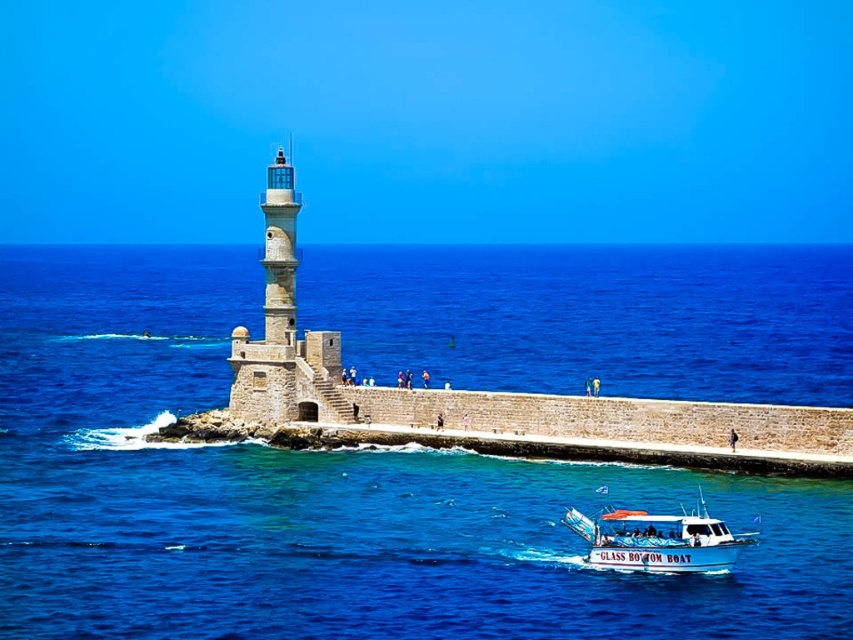
Between stone lighthouse at center and white glossy glass-bottom boat at lower center, which one has more height?

stone lighthouse at center is taller.

This screenshot has width=853, height=640. What are the coordinates of `stone lighthouse at center` in the screenshot? It's located at (283, 328).

Is the position of blue stone water at center more distant than that of smooth stone lighthouse at center?

No, blue stone water at center is in front of smooth stone lighthouse at center.

Does blue stone water at center lie in front of smooth stone lighthouse at center?

Yes, it is in front of smooth stone lighthouse at center.

The width and height of the screenshot is (853, 640). Describe the element at coordinates (322, 496) in the screenshot. I see `blue stone water at center` at that location.

At what (x,y) coordinates should I click in order to perform the action: click on blue stone water at center. Please return your answer as a coordinate pair (x, y). Image resolution: width=853 pixels, height=640 pixels. Looking at the image, I should click on (322, 496).

Does white glossy glass-bottom boat at lower center appear under smooth stone lighthouse at center?

Yes.

Can you confirm if white glossy glass-bottom boat at lower center is shorter than smooth stone lighthouse at center?

Yes.

Between point (666, 566) and point (282, 241), which one is positioned behind?

Positioned behind is point (282, 241).

At what (x,y) coordinates should I click in order to perform the action: click on white glossy glass-bottom boat at lower center. Please return your answer as a coordinate pair (x, y). This screenshot has width=853, height=640. Looking at the image, I should click on (659, 540).